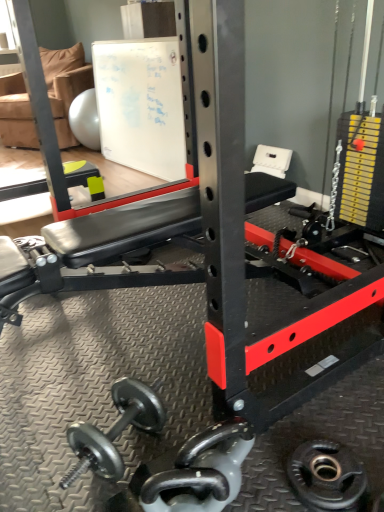
Question: Should I look upward or downward to see polished silver dumbbell at center?

Choices:
 (A) up
 (B) down

Answer: (B)

Question: From a real-world perspective, is white matte board at upper center positioned over black rubber weight plate at lower right based on gravity?

Choices:
 (A) yes
 (B) no

Answer: (A)

Question: Would you say black rubber weight plate at lower right is part of white matte board at upper center's contents?

Choices:
 (A) no
 (B) yes

Answer: (A)

Question: Does white matte board at upper center turn towards black rubber weight plate at lower right?

Choices:
 (A) yes
 (B) no

Answer: (B)

Question: Is white matte board at upper center bigger than black rubber weight plate at lower right?

Choices:
 (A) yes
 (B) no

Answer: (A)

Question: Does white matte board at upper center have a greater height compared to black rubber weight plate at lower right?

Choices:
 (A) yes
 (B) no

Answer: (A)

Question: Is white matte board at upper center thinner than black rubber weight plate at lower right?

Choices:
 (A) no
 (B) yes

Answer: (A)

Question: Is black rubber weight plate at lower right aimed at tan fabric chair at upper left?

Choices:
 (A) no
 (B) yes

Answer: (A)

Question: Considering the relative sizes of black rubber weight plate at lower right and tan fabric chair at upper left in the image provided, is black rubber weight plate at lower right wider than tan fabric chair at upper left?

Choices:
 (A) yes
 (B) no

Answer: (B)

Question: Is black rubber weight plate at lower right further to the viewer compared to tan fabric chair at upper left?

Choices:
 (A) no
 (B) yes

Answer: (A)

Question: Is black rubber weight plate at lower right to the right of tan fabric chair at upper left from the viewer's perspective?

Choices:
 (A) no
 (B) yes

Answer: (B)

Question: Is black rubber weight plate at lower right far away from tan fabric chair at upper left?

Choices:
 (A) yes
 (B) no

Answer: (A)

Question: Is black rubber weight plate at lower right oriented away from tan fabric chair at upper left?

Choices:
 (A) yes
 (B) no

Answer: (B)

Question: Is polished silver dumbbell at center bigger than tan fabric chair at upper left?

Choices:
 (A) no
 (B) yes

Answer: (A)